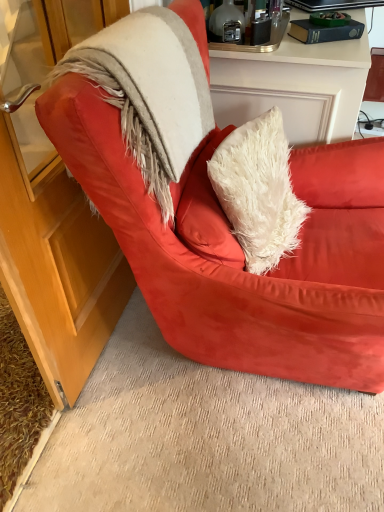
Question: Is point (357, 229) positioned closer to the camera than point (132, 113)?

Choices:
 (A) closer
 (B) farther

Answer: (B)

Question: From the image's perspective, is suede red armchair at center above or below fuzzy beige fur coat at upper left?

Choices:
 (A) above
 (B) below

Answer: (B)

Question: Estimate the real-world distances between objects in this image. Which object is closer to the fuzzy beige fur coat at upper left?

Choices:
 (A) black glossy laptop at upper right
 (B) suede red armchair at center

Answer: (B)

Question: Considering the real-world distances, which object is farthest from the suede red armchair at center?

Choices:
 (A) black glossy laptop at upper right
 (B) fuzzy beige fur coat at upper left

Answer: (A)